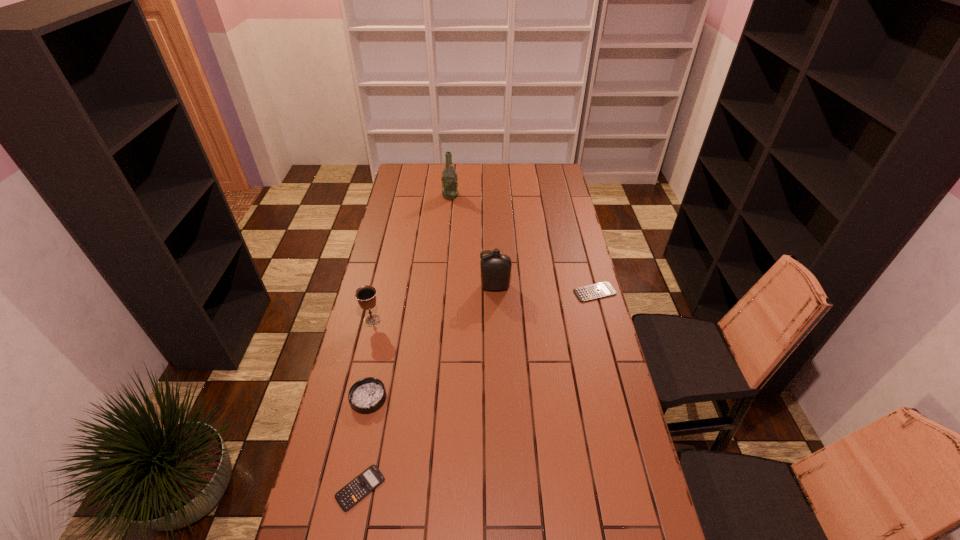
Where is `chalice that is at the left edge`? This screenshot has height=540, width=960. chalice that is at the left edge is located at coordinates tap(366, 295).

You are a GUI agent. You are given a task and a screenshot of the screen. Output one action in this format:
    pyautogui.click(x=<x>, y=<y>)
    Task: Click on the ashtray that is at the left edge
    The width and height of the screenshot is (960, 540).
    Given the screenshot: What is the action you would take?
    pyautogui.click(x=367, y=395)

Find the location of `object located in the right edge section of the desktop`. object located in the right edge section of the desktop is located at coordinates (599, 290).

At what (x,y) coordinates should I click in order to perform the action: click on object present at the near left corner. Please return your answer as a coordinate pair (x, y). Looking at the image, I should click on (347, 497).

The height and width of the screenshot is (540, 960). I want to click on free spot at the far edge of the desktop, so click(x=483, y=174).

Find the location of a particular element. free space at the near edge of the desktop is located at coordinates (431, 519).

Locate an element on the screen. Image resolution: width=960 pixels, height=540 pixels. vacant space at the left edge of the desktop is located at coordinates (381, 285).

The image size is (960, 540). In the image, there is a desktop. In order to click on vacant space at the right edge in this screenshot , I will do `click(547, 253)`.

Find the location of a particular element. The width and height of the screenshot is (960, 540). free spot at the far left corner of the desktop is located at coordinates (406, 174).

This screenshot has width=960, height=540. In the image, there is a desktop. Identify the location of blank space at the far right corner. (555, 168).